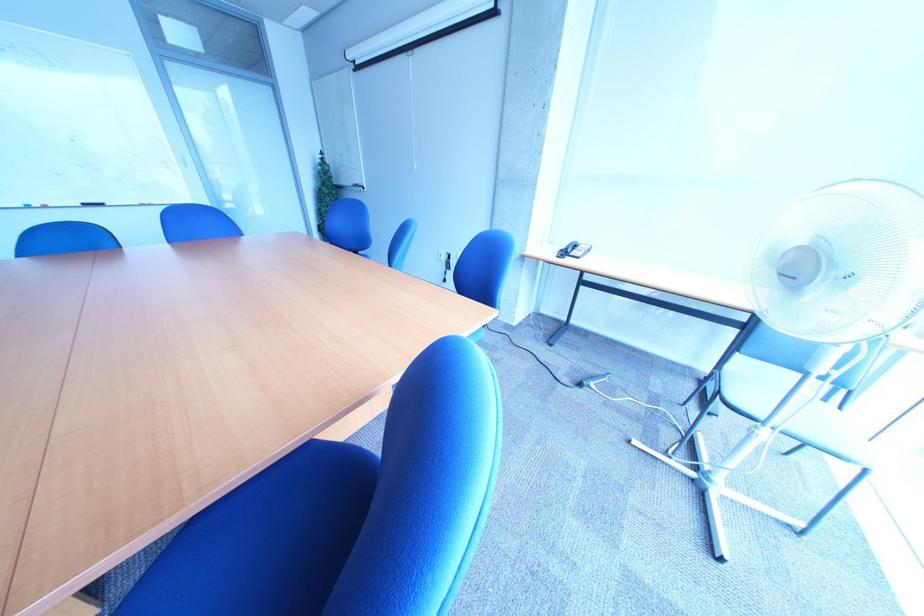
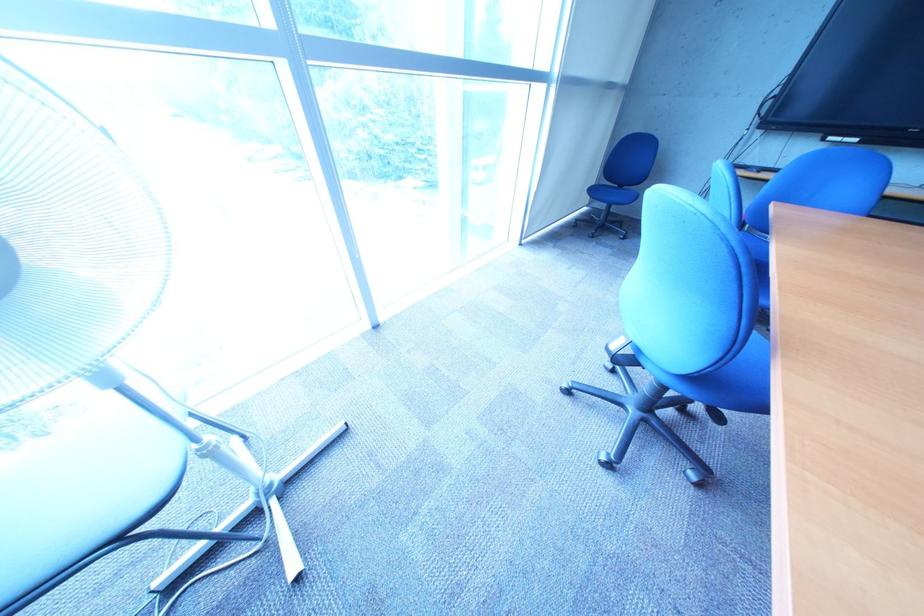
Locate, in the second image, the point that corresponds to (x=772, y=434) in the first image.

(229, 445)